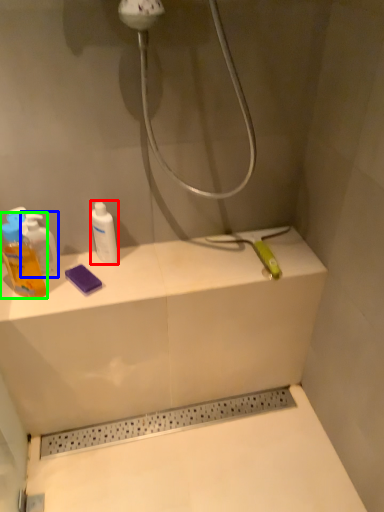
Question: Which is farther away from mouthwash (highlighted by a red box)? mouthwash (highlighted by a blue box) or mouthwash (highlighted by a green box)?

Choices:
 (A) mouthwash
 (B) mouthwash

Answer: (B)